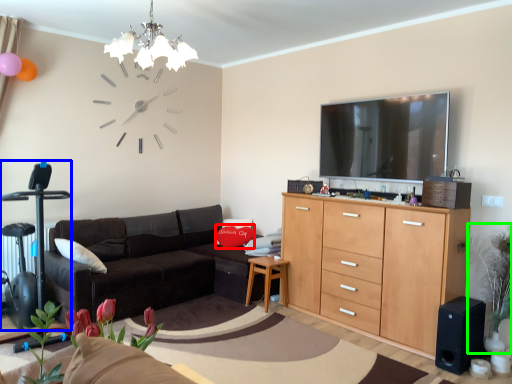
Question: Which object is the closest to the flower (highlighted by a red box)? Choose among these: swivel chair (highlighted by a blue box) or plant (highlighted by a green box).

Choices:
 (A) swivel chair
 (B) plant

Answer: (A)